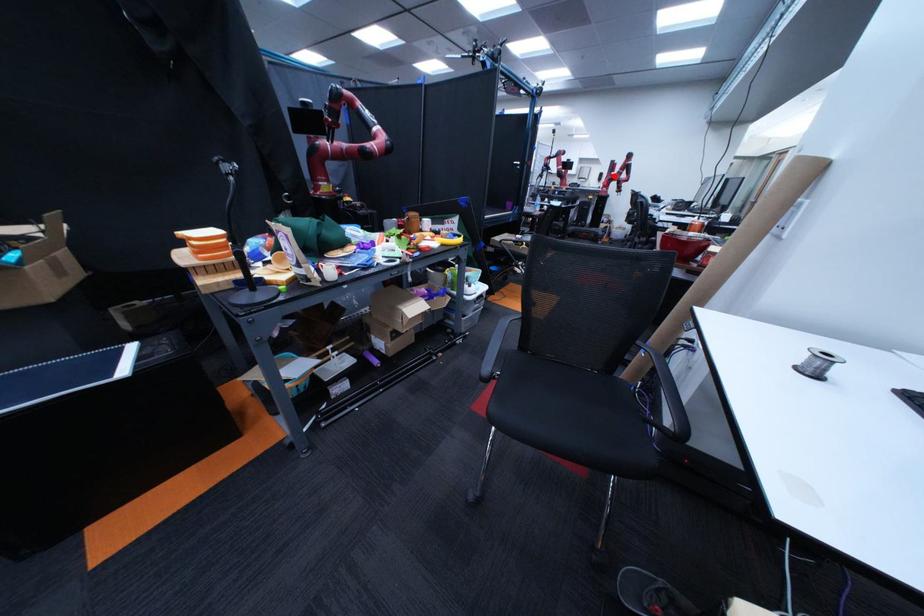
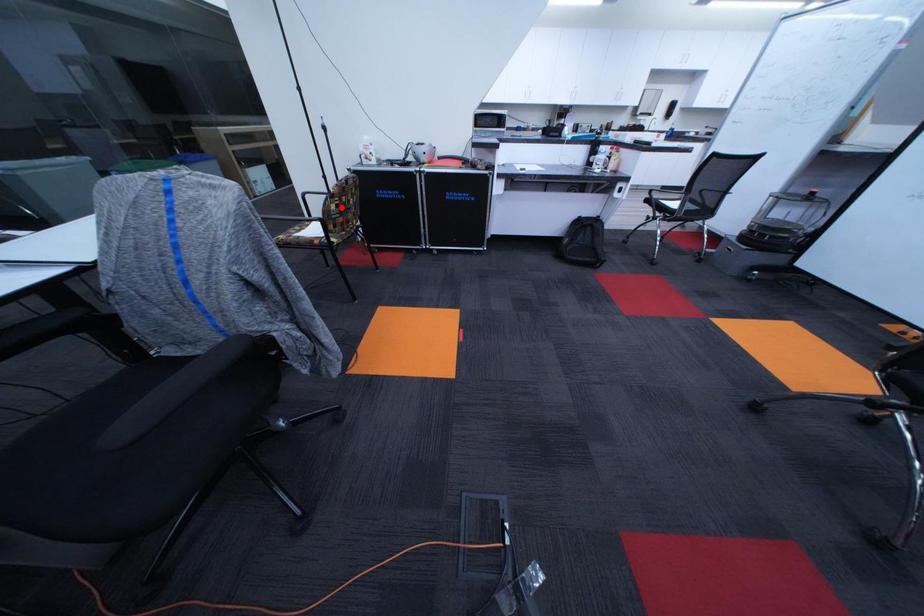
I am providing you with two images of the same scene from different viewpoints. A red point is marked on the first image and another point is marked on the second image. Do the highlighted points in image1 and image2 indicate the same real-world spot?

No